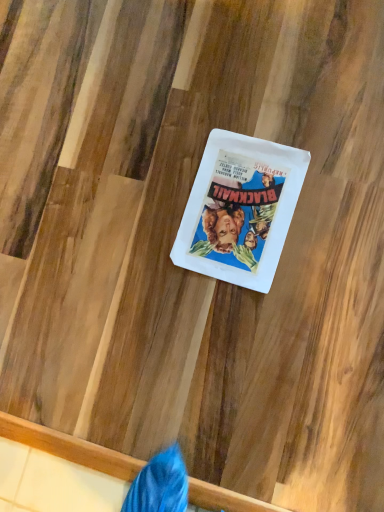
Find the location of a particular element. vacant area located to the right-hand side of white paper at center is located at coordinates (316, 130).